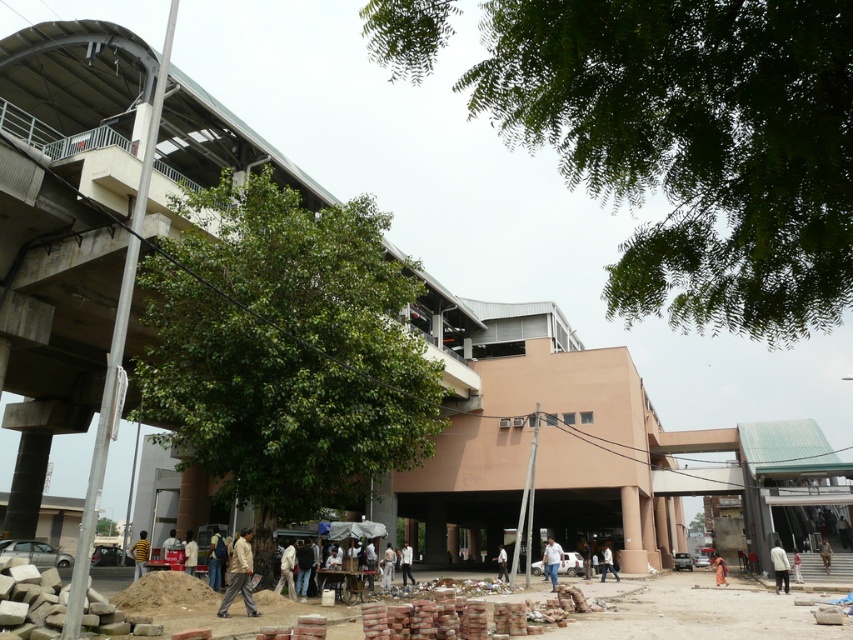
Question: Which is farther from the white matte shirt at lower right?

Choices:
 (A) green leafy tree at center
 (B) white cotton shirt at center
 (C) light brown fabric shirt at lower center

Answer: (C)

Question: Does green leafy tree at center appear on the right side of brown cotton shirt at center?

Choices:
 (A) yes
 (B) no

Answer: (B)

Question: Which point is farther from the camera taking this photo?

Choices:
 (A) (193, 538)
 (B) (506, 580)

Answer: (A)

Question: Which of these objects is positioned farthest from the brown cotton shirt at center?

Choices:
 (A) light brown fabric jacket at lower center
 (B) light brown fabric shirt at center

Answer: (A)

Question: Does yellow striped shirt at center appear under light brown fabric jacket at lower center?

Choices:
 (A) no
 (B) yes

Answer: (A)

Question: Does green leafy tree at upper center lie behind green leafy tree at center?

Choices:
 (A) yes
 (B) no

Answer: (B)